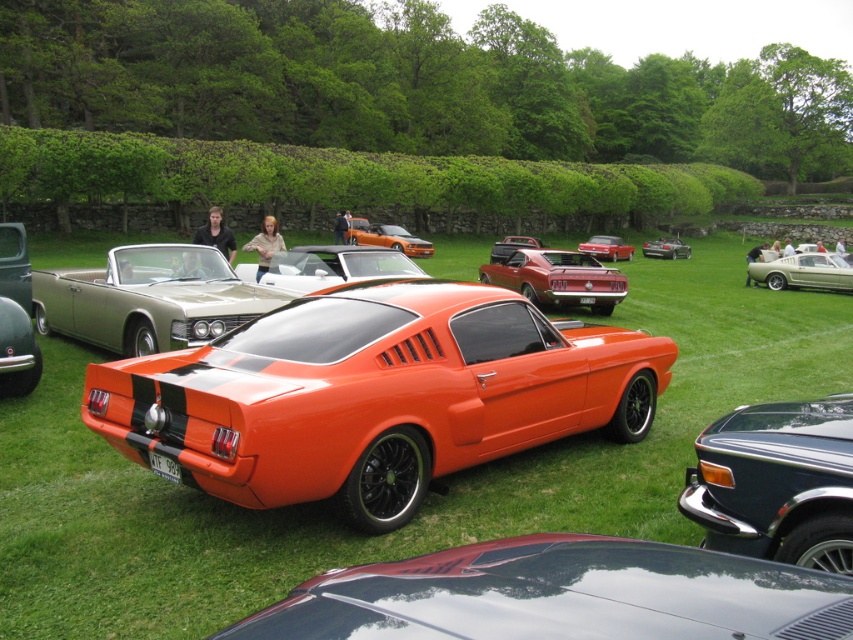
Question: Which object appears farthest from the camera in this image?

Choices:
 (A) metallic gold convertible at center-left
 (B) shiny metallic car at center
 (C) metallic silver car at right

Answer: (C)

Question: Estimate the real-world distances between objects in this image. Which object is closer to the shiny orange convertible at center?

Choices:
 (A) shiny metallic car at center
 (B) metallic gold convertible at center-left
 (C) metallic silver car at right
 (D) shiny black car at center

Answer: (C)

Question: Does shiny metallic car at center appear under metallic silver convertible at center?

Choices:
 (A) yes
 (B) no

Answer: (A)

Question: Does shiny orange convertible at center appear under metallic red car at center?

Choices:
 (A) yes
 (B) no

Answer: (A)

Question: Among these objects, which one is nearest to the camera?

Choices:
 (A) shiny orange convertible at center
 (B) glossy black car at lower right
 (C) metallic gold convertible at center-left
 (D) metallic silver car at right

Answer: (B)

Question: Can you confirm if white glossy convertible at center is positioned above metallic red car at center?

Choices:
 (A) yes
 (B) no

Answer: (B)